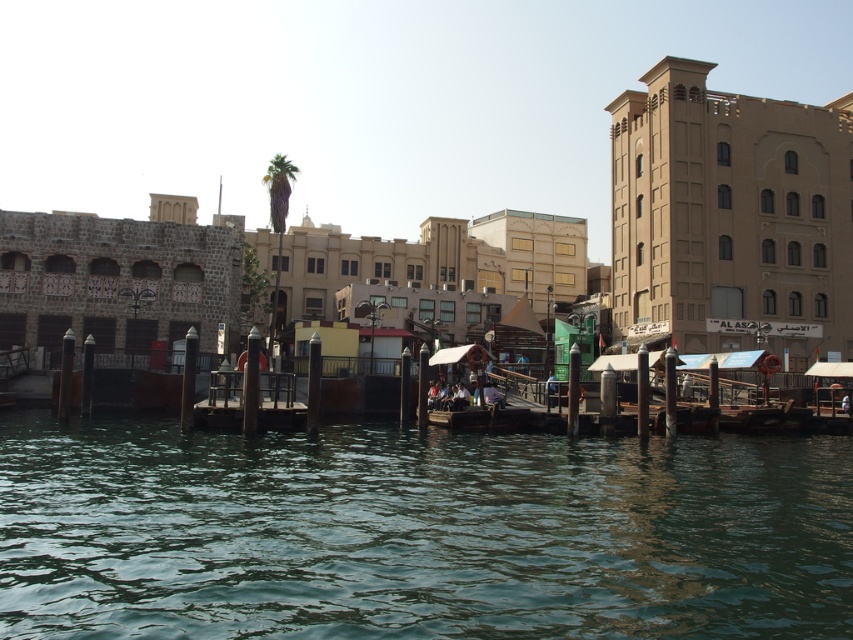
This screenshot has height=640, width=853. What do you see at coordinates (418, 532) in the screenshot?
I see `greenish water at center` at bounding box center [418, 532].

Is greenish water at center above stone textured hut at left?

No, greenish water at center is not above stone textured hut at left.

Does point (769, 509) come behind point (158, 269)?

No.

This screenshot has height=640, width=853. What are the coordinates of `greenish water at center` in the screenshot? It's located at (418, 532).

Who is taller, stone textured hut at left or wooden dock at center?

stone textured hut at left

Does stone textured hut at left come behind wooden dock at center?

Yes, it is behind wooden dock at center.

At what (x,y) coordinates should I click in order to perform the action: click on stone textured hut at left. Please return your answer as a coordinate pair (x, y). Image resolution: width=853 pixels, height=640 pixels. Looking at the image, I should click on (115, 280).

Is greenish water at center closer to the viewer compared to wooden dock at center?

That is True.

Who is shorter, greenish water at center or wooden dock at center?

With less height is greenish water at center.

Image resolution: width=853 pixels, height=640 pixels. Identify the location of greenish water at center. (418, 532).